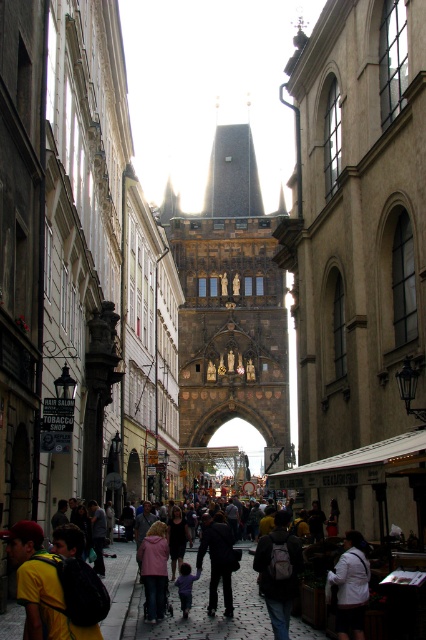
Question: Which point appears closest to the camera in this image?

Choices:
 (A) (176, 577)
 (B) (230, 612)

Answer: (B)

Question: Estimate the real-world distances between objects in this image. Which object is farther from the white fabric jacket at center?

Choices:
 (A) matte black backpack at center
 (B) dark brown stone tower at center
 (C) purple fabric at center
 (D) pink fabric jacket at center

Answer: (B)

Question: Based on their relative distances, which object is nearer to the pink fabric jacket at center?

Choices:
 (A) dark blue jeans at center
 (B) white fabric jacket at center
 (C) dark brown stone tower at center

Answer: (A)

Question: Is dark blue jeans at center to the left of pink fabric jacket at center from the viewer's perspective?

Choices:
 (A) no
 (B) yes

Answer: (A)

Question: Does dark brown stone tower at center appear on the right side of white fabric jacket at center?

Choices:
 (A) no
 (B) yes

Answer: (A)

Question: In this image, where is matte black backpack at center located relative to dark blue jeans at center?

Choices:
 (A) right
 (B) left

Answer: (A)